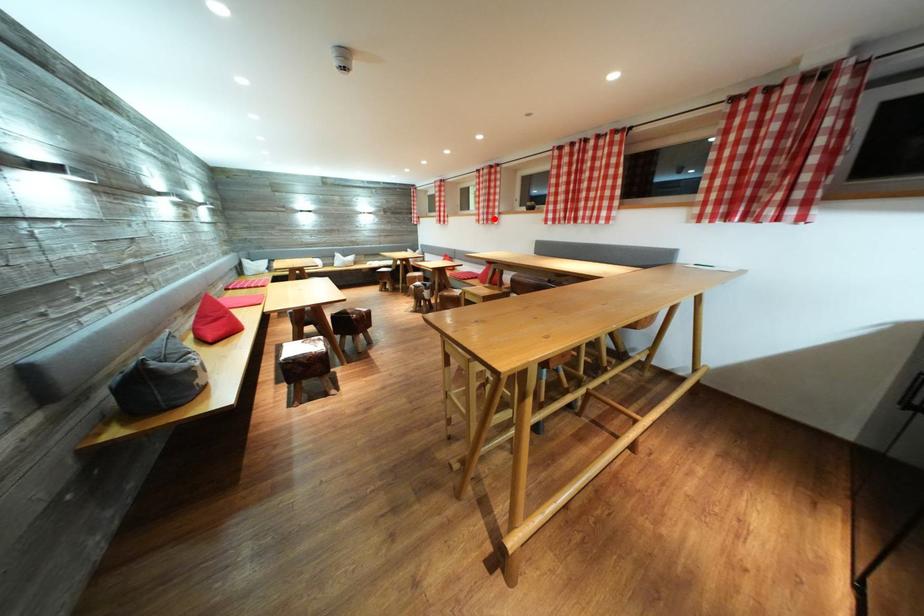
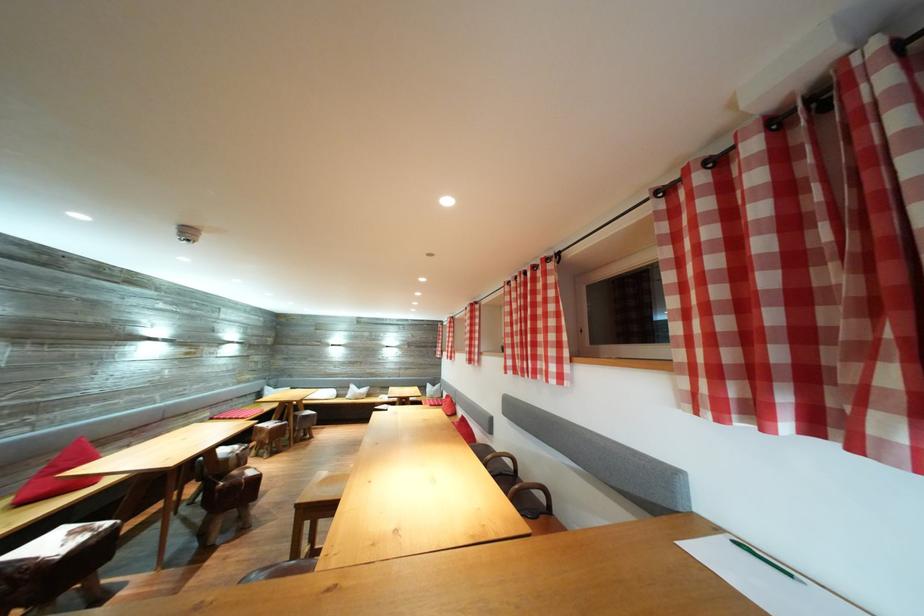
Question: I am providing you with two images of the same scene from different viewpoints. Image1 has a red point marked. In image2, the corresponding 3D location appears at what relative position? Reply with the corresponding letter.

Choices:
 (A) Closer
 (B) Farther

Answer: (B)